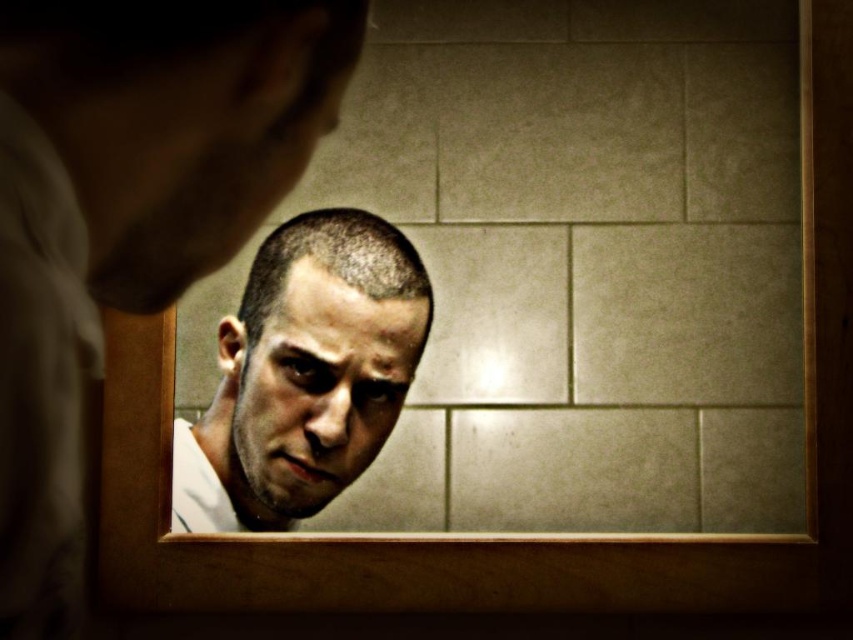
Question: Does smooth skin face at center have a lesser width compared to shiny skin face at center?

Choices:
 (A) yes
 (B) no

Answer: (B)

Question: Which point is closer to the camera?

Choices:
 (A) (239, 216)
 (B) (294, 304)

Answer: (A)

Question: Which point appears farthest from the camera in this image?

Choices:
 (A) (184, 195)
 (B) (0, 12)
 (C) (316, 422)

Answer: (C)

Question: Does smooth white shirt at upper left lie behind smooth skin face at center?

Choices:
 (A) yes
 (B) no

Answer: (B)

Question: Does smooth skin face at center appear under shiny skin face at center?

Choices:
 (A) no
 (B) yes

Answer: (B)

Question: Considering the real-world distances, which object is farthest from the smooth skin face at center?

Choices:
 (A) smooth white shirt at upper left
 (B) shiny skin face at center

Answer: (A)